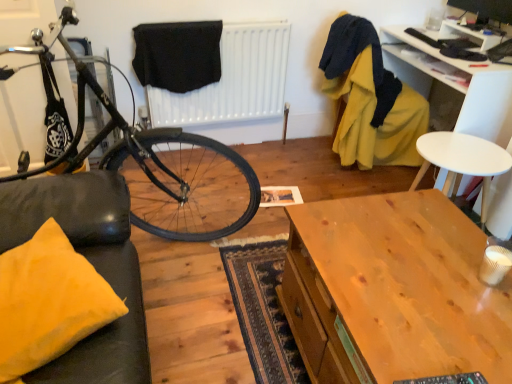
In order to face white matte table at center right, should I rotate leftwards or rightwards?

You should rotate right by 24.359 degrees.

What is the approximate height of black fabric at center?

The height of black fabric at center is 15.45 inches.

What do you see at coordinates (178, 55) in the screenshot? The image size is (512, 384). I see `black fabric at center` at bounding box center [178, 55].

This screenshot has width=512, height=384. Describe the element at coordinates (233, 80) in the screenshot. I see `black fabric at upper center` at that location.

Where is `yellow fabric armchair at upper right`? This screenshot has height=384, width=512. yellow fabric armchair at upper right is located at coordinates (370, 99).

Measure the distance between yellow fabric pillow at lower left and camera.

The depth of yellow fabric pillow at lower left is 3.47 feet.

Find the location of a particular element. white matte table at center right is located at coordinates (462, 160).

Based on the photo, is yellow fabric pillow at lower left not close to white plastic chair at upper right, which is the 2th desk from front to back?

That's right, there is a large distance between yellow fabric pillow at lower left and white plastic chair at upper right, which is the 2th desk from front to back.

Could you tell me if yellow fabric pillow at lower left is facing white plastic chair at upper right, positioned as the first desk in right-to-left order?

Yes, yellow fabric pillow at lower left is aimed at white plastic chair at upper right, positioned as the first desk in right-to-left order.

In the image, is yellow fabric pillow at lower left on the left side or the right side of white plastic chair at upper right, which is counted as the second desk, starting from the bottom?

yellow fabric pillow at lower left is positioned on white plastic chair at upper right, which is counted as the second desk, starting from the bottom,'s left side.

This screenshot has width=512, height=384. I want to click on pillow located below the white plastic chair at upper right, which is counted as the second desk, starting from the bottom (from the image's perspective), so click(49, 302).

Is yellow fabric armchair at upper right not within white plastic chair at upper right, placed as the second desk when sorted from left to right?

Indeed, yellow fabric armchair at upper right is completely outside white plastic chair at upper right, placed as the second desk when sorted from left to right.

From the image's perspective, is yellow fabric armchair at upper right located above or below white plastic chair at upper right, which is the 1th desk in top-to-bottom order?

Clearly, from the image's perspective, yellow fabric armchair at upper right is above white plastic chair at upper right, which is the 1th desk in top-to-bottom order.

From a real-world perspective, is yellow fabric armchair at upper right on white plastic chair at upper right, positioned as the first desk in right-to-left order?

Yes, from a real-world perspective, yellow fabric armchair at upper right is above white plastic chair at upper right, positioned as the first desk in right-to-left order.

Can you confirm if yellow fabric armchair at upper right is wider than white plastic chair at upper right, positioned as the first desk in right-to-left order?

Yes.

Is white matte table at center right not close to wooden desk at center, which appears as the 2th desk when viewed from the back?

No.

Who is more distant, white matte table at center right or wooden desk at center, the 1th desk from the front?

Positioned behind is white matte table at center right.

Which of these two, white matte table at center right or wooden desk at center, the 1th desk from the front, is bigger?

wooden desk at center, the 1th desk from the front.

Considering the relative sizes of white matte table at center right and wooden desk at center, which appears as the 2th desk when viewed from the back, in the image provided, is white matte table at center right wider than wooden desk at center, which appears as the 2th desk when viewed from the back,?

In fact, white matte table at center right might be narrower than wooden desk at center, which appears as the 2th desk when viewed from the back.

Is wooden desk at center, marked as the 1th desk in a bottom-to-top arrangement, taller or shorter than yellow fabric pillow at lower left?

Clearly, wooden desk at center, marked as the 1th desk in a bottom-to-top arrangement, is taller compared to yellow fabric pillow at lower left.

Which object is positioned more to the left, wooden desk at center, which appears as the 2th desk when viewed from the back, or yellow fabric pillow at lower left?

From the viewer's perspective, yellow fabric pillow at lower left appears more on the left side.

Looking at this image, from a real-world perspective, does wooden desk at center, the 2th desk positioned from the top, sit lower than yellow fabric pillow at lower left?

Indeed, from a real-world perspective, wooden desk at center, the 2th desk positioned from the top, is positioned beneath yellow fabric pillow at lower left.

Is wooden desk at center, the 2th desk positioned from the top, a part of yellow fabric pillow at lower left?

No, wooden desk at center, the 2th desk positioned from the top, is not inside yellow fabric pillow at lower left.

Who is bigger, yellow fabric pillow at lower left or wooden desk at center, marked as the 1th desk in a bottom-to-top arrangement?

wooden desk at center, marked as the 1th desk in a bottom-to-top arrangement, is bigger.

Does yellow fabric pillow at lower left turn towards wooden desk at center, which appears as the 2th desk when viewed from the back?

No, yellow fabric pillow at lower left is not aimed at wooden desk at center, which appears as the 2th desk when viewed from the back.

I want to click on desk below the white matte table at center right (from the image's perspective), so click(x=393, y=291).

Is wooden desk at center, which appears as the 2th desk when viewed from the back, bigger than white matte table at center right?

Yes.

Which is in front, wooden desk at center, which appears as the 2th desk when viewed from the back, or white matte table at center right?

wooden desk at center, which appears as the 2th desk when viewed from the back, is in front.

Does wooden desk at center, acting as the first desk starting from the left, turn towards white matte table at center right?

No, wooden desk at center, acting as the first desk starting from the left, is not oriented towards white matte table at center right.

Consider the image. Considering the relative sizes of black fabric at center and white matte table at center right in the image provided, is black fabric at center smaller than white matte table at center right?

Yes, black fabric at center is smaller than white matte table at center right.

Consider the image. Between black fabric at center and white matte table at center right, which one is positioned in front?

white matte table at center right.

Does black fabric at center have a greater width compared to white matte table at center right?

In fact, black fabric at center might be narrower than white matte table at center right.

Is black fabric at center inside the boundaries of white matte table at center right, or outside?

black fabric at center is not inside white matte table at center right, it's outside.

This screenshot has height=384, width=512. In order to click on desk above the yellow fabric pillow at lower left (from the image's perspective) in this screenshot , I will do `click(454, 84)`.

You are a GUI agent. You are given a task and a screenshot of the screen. Output one action in this format:
    pyautogui.click(x=<x>, y=<y>)
    Task: Click on the 1st desk below the yellow fabric armchair at upper right (from the image's perspective)
    
    Given the screenshot: What is the action you would take?
    pyautogui.click(x=454, y=84)

When comparing their distances from white matte table at center right, does black fabric at center or white plastic chair at upper right, which is the 1th desk in top-to-bottom order, seem closer?

white plastic chair at upper right, which is the 1th desk in top-to-bottom order, is positioned closer to the anchor white matte table at center right.

Which object lies further to the anchor point black fabric at center, wooden desk at center, the 2th desk positioned from the top, or black fabric at upper center?

wooden desk at center, the 2th desk positioned from the top, is further to black fabric at center.

Looking at the image, which one is located closer to yellow fabric armchair at upper right, shiny black bicycle at left or black fabric at center?

Based on the image, black fabric at center appears to be nearer to yellow fabric armchair at upper right.

In the scene shown: From the image, which object appears to be nearer to wooden desk at center, which appears as the 2th desk when viewed from the back, white plastic chair at upper right, placed as the second desk when sorted from left to right, or white matte table at center right?

white matte table at center right lies closer to wooden desk at center, which appears as the 2th desk when viewed from the back, than the other object.

Considering their positions, is wooden desk at center, which is the 2th desk in right-to-left order, positioned closer to white plastic chair at upper right, which is the first desk from back to front, than black fabric at center?

Based on the image, wooden desk at center, which is the 2th desk in right-to-left order, appears to be nearer to white plastic chair at upper right, which is the first desk from back to front.

Estimate the real-world distances between objects in this image. Which object is closer to shiny black bicycle at left, white plastic chair at upper right, which is the first desk from back to front, or yellow fabric pillow at lower left?

yellow fabric pillow at lower left is closer to shiny black bicycle at left.

Based on their spatial positions, is black fabric at center or black fabric at upper center closer to white matte table at center right?

Based on the image, black fabric at upper center appears to be nearer to white matte table at center right.

Estimate the real-world distances between objects in this image. Which object is closer to black fabric at upper center, yellow fabric armchair at upper right or white matte table at center right?

yellow fabric armchair at upper right.

The height and width of the screenshot is (384, 512). In order to click on clothe positioned between wooden desk at center, the 2th desk positioned from the top, and black fabric at upper center from near to far in this screenshot , I will do tap(178, 55).

Where is `desk between wooden desk at center, which is the 2th desk in right-to-left order, and yellow fabric armchair at upper right from front to back`? The width and height of the screenshot is (512, 384). desk between wooden desk at center, which is the 2th desk in right-to-left order, and yellow fabric armchair at upper right from front to back is located at coordinates (454, 84).

The image size is (512, 384). Find the location of `table positioned between wooden desk at center, marked as the 1th desk in a bottom-to-top arrangement, and black fabric at upper center from near to far`. table positioned between wooden desk at center, marked as the 1th desk in a bottom-to-top arrangement, and black fabric at upper center from near to far is located at coordinates (462, 160).

This screenshot has height=384, width=512. Find the location of `table between black fabric at center and white plastic chair at upper right, which is counted as the second desk, starting from the bottom`. table between black fabric at center and white plastic chair at upper right, which is counted as the second desk, starting from the bottom is located at coordinates (462, 160).